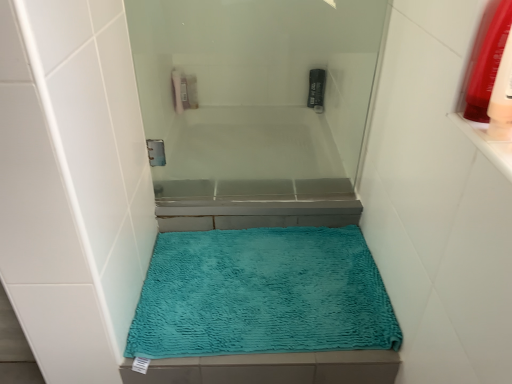
I want to click on teal plush bath mat at center, so click(262, 294).

From the image's perspective, is teal plush bath mat at center on top of translucent plastic mouthwash at upper right, which appears as the second mouthwash when viewed from the left?

Actually, teal plush bath mat at center appears below translucent plastic mouthwash at upper right, which appears as the second mouthwash when viewed from the left, in the image.

Between teal plush bath mat at center and translucent plastic mouthwash at upper right, arranged as the 1th mouthwash when viewed from the front, which one is positioned in front?

translucent plastic mouthwash at upper right, arranged as the 1th mouthwash when viewed from the front, is in front.

In the scene shown: Is teal plush bath mat at center situated inside translucent plastic mouthwash at upper right, which appears as the second mouthwash when viewed from the left, or outside?

teal plush bath mat at center is not enclosed by translucent plastic mouthwash at upper right, which appears as the second mouthwash when viewed from the left.

Is teal plush bath mat at center facing towards translucent plastic mouthwash at upper right, which ranks as the 1th mouthwash in bottom-to-top order?

No, teal plush bath mat at center is not oriented towards translucent plastic mouthwash at upper right, which ranks as the 1th mouthwash in bottom-to-top order.

Considering the positions of point (308, 94) and point (380, 29), is point (308, 94) closer or farther from the camera than point (380, 29)?

Point (308, 94) is positioned farther from the camera compared to point (380, 29).

Is transparent glass screen door at upper center at the back of black plastic mouthwash at upper center, which ranks as the second mouthwash in bottom-to-top order?

black plastic mouthwash at upper center, which ranks as the second mouthwash in bottom-to-top order, does not have its back to transparent glass screen door at upper center.

Considering the positions of objects black plastic mouthwash at upper center, which ranks as the second mouthwash in bottom-to-top order, and transparent glass screen door at upper center in the image provided, who is more to the left, black plastic mouthwash at upper center, which ranks as the second mouthwash in bottom-to-top order, or transparent glass screen door at upper center?

transparent glass screen door at upper center is more to the left.

Is teal plush bath mat at center taller than black plastic mouthwash at upper center, which ranks as the second mouthwash in bottom-to-top order?

Incorrect, the height of teal plush bath mat at center is not larger of that of black plastic mouthwash at upper center, which ranks as the second mouthwash in bottom-to-top order.

Can you confirm if teal plush bath mat at center is bigger than black plastic mouthwash at upper center, which appears as the second mouthwash when viewed from the right?

Correct, teal plush bath mat at center is larger in size than black plastic mouthwash at upper center, which appears as the second mouthwash when viewed from the right.

Would you say black plastic mouthwash at upper center, which is the 1th mouthwash from back to front, is part of teal plush bath mat at center's contents?

No.

Between teal plush bath mat at center and black plastic mouthwash at upper center, which is the 1th mouthwash from back to front, which one is positioned in front?

Positioned in front is teal plush bath mat at center.

From the picture: How distant is translucent plastic mouthwash at upper right, marked as the 2th mouthwash in a top-to-bottom arrangement, from black plastic mouthwash at upper center, placed as the 1th mouthwash when sorted from top to bottom?

23.71 inches.

Consider the image. Is the surface of translucent plastic mouthwash at upper right, which ranks as the second mouthwash in back-to-front order, in direct contact with black plastic mouthwash at upper center, the 2th mouthwash in the front-to-back sequence?

There is a gap between translucent plastic mouthwash at upper right, which ranks as the second mouthwash in back-to-front order, and black plastic mouthwash at upper center, the 2th mouthwash in the front-to-back sequence.

From a real-world perspective, is translucent plastic mouthwash at upper right, which ranks as the second mouthwash in back-to-front order, positioned over black plastic mouthwash at upper center, the 2th mouthwash in the front-to-back sequence, based on gravity?

Yes, from a real-world perspective, translucent plastic mouthwash at upper right, which ranks as the second mouthwash in back-to-front order, is on top of black plastic mouthwash at upper center, the 2th mouthwash in the front-to-back sequence.

Considering the points (472, 75) and (311, 98), which point is in front, point (472, 75) or point (311, 98)?

The point (472, 75) is in front.

Can you confirm if teal plush bath mat at center is taller than transparent glass screen door at upper center?

No, teal plush bath mat at center is not taller than transparent glass screen door at upper center.

In the scene shown: Would you say teal plush bath mat at center is a long distance from transparent glass screen door at upper center?

No.

Between point (237, 325) and point (279, 181), which one is positioned behind?

Positioned behind is point (279, 181).

Can you confirm if transparent glass screen door at upper center is positioned to the right of translucent plastic mouthwash at upper right, marked as the 2th mouthwash in a top-to-bottom arrangement?

Incorrect, transparent glass screen door at upper center is not on the right side of translucent plastic mouthwash at upper right, marked as the 2th mouthwash in a top-to-bottom arrangement.

Where is `screen door to the left of translucent plastic mouthwash at upper right, arranged as the 1th mouthwash when viewed from the front`? This screenshot has width=512, height=384. screen door to the left of translucent plastic mouthwash at upper right, arranged as the 1th mouthwash when viewed from the front is located at coordinates (255, 108).

Consider the image. Which object is closer to the camera taking this photo, transparent glass screen door at upper center or translucent plastic mouthwash at upper right, marked as the 2th mouthwash in a top-to-bottom arrangement?

Positioned in front is translucent plastic mouthwash at upper right, marked as the 2th mouthwash in a top-to-bottom arrangement.

Based on the photo, can you see transparent glass screen door at upper center touching translucent plastic mouthwash at upper right, which appears as the second mouthwash when viewed from the left?

No.

Is black plastic mouthwash at upper center, acting as the 1th mouthwash starting from the left, completely or partially outside of translucent plastic mouthwash at upper right, marked as the 2th mouthwash in a top-to-bottom arrangement?

Absolutely, black plastic mouthwash at upper center, acting as the 1th mouthwash starting from the left, is external to translucent plastic mouthwash at upper right, marked as the 2th mouthwash in a top-to-bottom arrangement.

Is black plastic mouthwash at upper center, acting as the 1th mouthwash starting from the left, thinner than translucent plastic mouthwash at upper right, which ranks as the second mouthwash in back-to-front order?

Yes.

Is black plastic mouthwash at upper center, which ranks as the second mouthwash in bottom-to-top order, touching translucent plastic mouthwash at upper right, arranged as the 1th mouthwash when viewed from the front?

They are not placed beside each other.

Between black plastic mouthwash at upper center, the 2th mouthwash in the front-to-back sequence, and translucent plastic mouthwash at upper right, which appears as the second mouthwash when viewed from the left, which one has larger size?

Bigger between the two is translucent plastic mouthwash at upper right, which appears as the second mouthwash when viewed from the left.

Image resolution: width=512 pixels, height=384 pixels. Identify the location of bath mat located behind the translucent plastic mouthwash at upper right, which ranks as the 1th mouthwash in bottom-to-top order. click(x=262, y=294).

From the transparent glass screen door at upper center, count 1st mouthwash to the right and point to it. Please provide its 2D coordinates.

[(316, 89)]

Considering their positions, is black plastic mouthwash at upper center, which appears as the second mouthwash when viewed from the right, positioned closer to teal plush bath mat at center than transparent glass screen door at upper center?

Among the two, transparent glass screen door at upper center is located nearer to teal plush bath mat at center.

Based on their spatial positions, is teal plush bath mat at center or translucent plastic mouthwash at upper right, marked as the first mouthwash in a right-to-left arrangement, closer to transparent glass screen door at upper center?

The object closer to transparent glass screen door at upper center is teal plush bath mat at center.

Looking at the image, which one is located closer to black plastic mouthwash at upper center, which is the 1th mouthwash from back to front, transparent glass screen door at upper center or translucent plastic mouthwash at upper right, which ranks as the 1th mouthwash in bottom-to-top order?

transparent glass screen door at upper center is closer to black plastic mouthwash at upper center, which is the 1th mouthwash from back to front.

Estimate the real-world distances between objects in this image. Which object is closer to translucent plastic mouthwash at upper right, marked as the first mouthwash in a right-to-left arrangement, black plastic mouthwash at upper center, which ranks as the second mouthwash in bottom-to-top order, or teal plush bath mat at center?

black plastic mouthwash at upper center, which ranks as the second mouthwash in bottom-to-top order, is closer to translucent plastic mouthwash at upper right, marked as the first mouthwash in a right-to-left arrangement.

Looking at the image, which one is located closer to black plastic mouthwash at upper center, which appears as the second mouthwash when viewed from the right, translucent plastic mouthwash at upper right, which ranks as the 1th mouthwash in bottom-to-top order, or transparent glass screen door at upper center?

Based on the image, transparent glass screen door at upper center appears to be nearer to black plastic mouthwash at upper center, which appears as the second mouthwash when viewed from the right.

From the image, which object appears to be nearer to transparent glass screen door at upper center, teal plush bath mat at center or black plastic mouthwash at upper center, which ranks as the second mouthwash in bottom-to-top order?

teal plush bath mat at center is closer to transparent glass screen door at upper center.

From the image, which object appears to be nearer to transparent glass screen door at upper center, black plastic mouthwash at upper center, which ranks as the second mouthwash in bottom-to-top order, or translucent plastic mouthwash at upper right, marked as the 2th mouthwash in a top-to-bottom arrangement?

black plastic mouthwash at upper center, which ranks as the second mouthwash in bottom-to-top order, lies closer to transparent glass screen door at upper center than the other object.

When comparing their distances from teal plush bath mat at center, does black plastic mouthwash at upper center, the 2th mouthwash in the front-to-back sequence, or translucent plastic mouthwash at upper right, which ranks as the second mouthwash in back-to-front order, seem further?

translucent plastic mouthwash at upper right, which ranks as the second mouthwash in back-to-front order, is further to teal plush bath mat at center.

Find the location of `screen door between translucent plastic mouthwash at upper right, marked as the first mouthwash in a right-to-left arrangement, and black plastic mouthwash at upper center, acting as the 1th mouthwash starting from the left, in the front-back direction`. screen door between translucent plastic mouthwash at upper right, marked as the first mouthwash in a right-to-left arrangement, and black plastic mouthwash at upper center, acting as the 1th mouthwash starting from the left, in the front-back direction is located at coordinates (255, 108).

What are the coordinates of `mouthwash between transparent glass screen door at upper center and teal plush bath mat at center in the vertical direction` in the screenshot? It's located at (485, 60).

At what (x,y) coordinates should I click in order to perform the action: click on bath mat between translucent plastic mouthwash at upper right, marked as the first mouthwash in a right-to-left arrangement, and black plastic mouthwash at upper center, placed as the 1th mouthwash when sorted from top to bottom, along the z-axis. Please return your answer as a coordinate pair (x, y). Looking at the image, I should click on (262, 294).

This screenshot has height=384, width=512. Identify the location of screen door positioned between teal plush bath mat at center and black plastic mouthwash at upper center, the 2th mouthwash in the front-to-back sequence, from near to far. (255, 108).